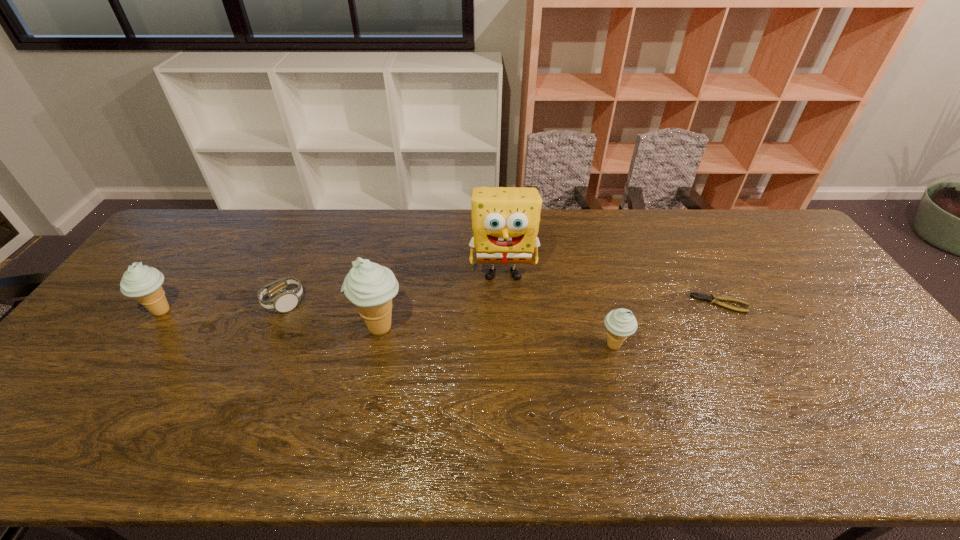
Find the location of a particular element. This screenshot has width=960, height=540. vacant space at the left edge of the desktop is located at coordinates (111, 309).

This screenshot has width=960, height=540. What are the coordinates of `free space at the right edge of the desktop` in the screenshot? It's located at (785, 256).

Identify the location of blank space at the far right corner. The image size is (960, 540). (744, 220).

Find the location of `unoccupied position between the fourth object from left to right and the rightmost object`. unoccupied position between the fourth object from left to right and the rightmost object is located at coordinates (612, 288).

Where is `blank region between the pliers and the watch`? The image size is (960, 540). blank region between the pliers and the watch is located at coordinates (502, 303).

This screenshot has width=960, height=540. I want to click on empty space that is in between the shortest object and the third tallest object, so click(x=442, y=307).

The height and width of the screenshot is (540, 960). What are the coordinates of `free spot between the leftmost icecream and the fourth object from left to right` in the screenshot? It's located at (333, 292).

This screenshot has height=540, width=960. In order to click on free space between the shortest object and the leftmost icecream in this screenshot , I will do `click(442, 307)`.

You are a GUI agent. You are given a task and a screenshot of the screen. Output one action in this format:
    pyautogui.click(x=<x>, y=<y>)
    Task: Click on the free space between the rightmost object and the rightmost icecream
    This screenshot has width=960, height=540.
    Given the screenshot: What is the action you would take?
    tap(667, 325)

Image resolution: width=960 pixels, height=540 pixels. I want to click on free spot between the third object from left to right and the pliers, so click(550, 316).